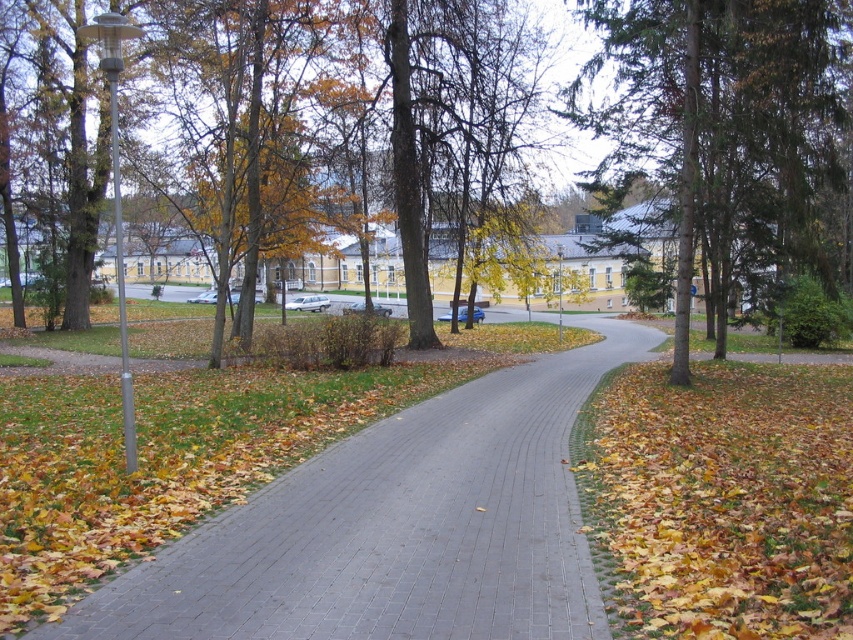
Looking at this image, you are planning to place a small garden ornament that measures 1 meter in width on the gray brick pavement at center. Considering the size of the yellow dry leaves at lower right, will the ornament fit on the pavement?

The gray brick pavement at center is larger in size than the yellow dry leaves at lower right. Since the ornament is 1 meter wide, and the pavement is bigger than the leaves, it should accommodate the ornament.

You are a gardener looking to plant a new tree in the park. You see the gray brick pavement at center and the green evergreen tree at upper right. Which object is shorter in height?

The gray brick pavement at center has a lesser height compared to the green evergreen tree at upper right, so the gray brick pavement at center is shorter.

You are a pedestrian walking along the gray brick pavement at center and want to reach the green evergreen tree at upper right. Which direction should you turn to face the tree?

You should turn to your right to face the green evergreen tree at upper right because the gray brick pavement at center is to the left of it.